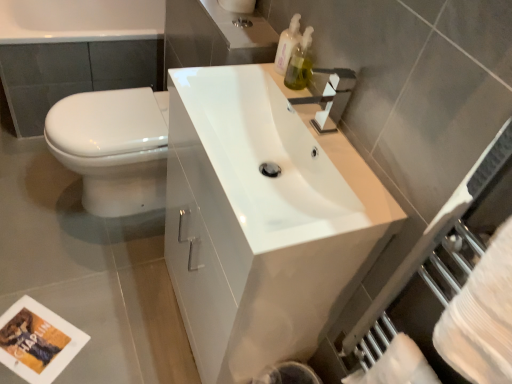
What do you see at coordinates (238, 5) in the screenshot? The image size is (512, 384). I see `white matte toilet paper at upper center, the second toilet paper positioned from the front` at bounding box center [238, 5].

How much space does white matte toilet paper at upper center, marked as the 1th toilet paper in a back-to-front arrangement, occupy horizontally?

white matte toilet paper at upper center, marked as the 1th toilet paper in a back-to-front arrangement, is 4.88 inches wide.

What do you see at coordinates (262, 220) in the screenshot? Image resolution: width=512 pixels, height=384 pixels. I see `white glossy sink at center` at bounding box center [262, 220].

Measure the distance between point (236, 20) and camera.

Point (236, 20) is 4.06 feet away from camera.

Where is `matte silver faucet at upper center`? matte silver faucet at upper center is located at coordinates (242, 22).

Describe the element at coordinates (287, 44) in the screenshot. I see `translucent plastic soap dispenser at upper right, arranged as the 1th soap dispenser when viewed from the top` at that location.

Where is `translucent plastic soap dispenser at upper right, the 2th soap dispenser from the bottom`? This screenshot has height=384, width=512. translucent plastic soap dispenser at upper right, the 2th soap dispenser from the bottom is located at coordinates (287, 44).

In the scene shown: What is the approximate width of white paper towel at lower right, the second toilet paper viewed from the left?

It is 8.14 centimeters.

You are a GUI agent. You are given a task and a screenshot of the screen. Output one action in this format:
    pyautogui.click(x=<x>, y=<y>)
    Task: Click on the white glossy bathtub at upper left
    
    Given the screenshot: What is the action you would take?
    pyautogui.click(x=76, y=52)

Find the location of `translucent plastic soap dispenser at upper right, which is the 1th soap dispenser from bottom to top`. translucent plastic soap dispenser at upper right, which is the 1th soap dispenser from bottom to top is located at coordinates (300, 63).

Image resolution: width=512 pixels, height=384 pixels. I want to click on white matte toilet paper at upper center, arranged as the second toilet paper when ordered from the bottom, so click(238, 5).

Looking at this image, is translucent plastic soap dispenser at upper right, the 2th soap dispenser from the bottom, bigger or smaller than white glossy toilet at left?

Considering their sizes, translucent plastic soap dispenser at upper right, the 2th soap dispenser from the bottom, takes up less space than white glossy toilet at left.

Is translucent plastic soap dispenser at upper right, arranged as the 1th soap dispenser when viewed from the top, at the right side of white glossy toilet at left?

Yes.

Is translucent plastic soap dispenser at upper right, arranged as the 1th soap dispenser when viewed from the top, shorter than white glossy toilet at left?

Yes, translucent plastic soap dispenser at upper right, arranged as the 1th soap dispenser when viewed from the top, is shorter than white glossy toilet at left.

From the image's perspective, is translucent plastic soap dispenser at upper right, arranged as the 1th soap dispenser when viewed from the top, below white glossy toilet at left?

Actually, translucent plastic soap dispenser at upper right, arranged as the 1th soap dispenser when viewed from the top, appears above white glossy toilet at left in the image.

Considering the sizes of objects translucent plastic soap dispenser at upper right, which is the 1th soap dispenser from bottom to top, and translucent plastic soap dispenser at upper right, arranged as the 1th soap dispenser when viewed from the top, in the image provided, who is bigger, translucent plastic soap dispenser at upper right, which is the 1th soap dispenser from bottom to top, or translucent plastic soap dispenser at upper right, arranged as the 1th soap dispenser when viewed from the top,?

Bigger between the two is translucent plastic soap dispenser at upper right, arranged as the 1th soap dispenser when viewed from the top.

How many degrees apart are the facing directions of translucent plastic soap dispenser at upper right, which appears as the 2th soap dispenser when viewed from the top, and translucent plastic soap dispenser at upper right, the 2th soap dispenser from the bottom?

The angle between the facing direction of translucent plastic soap dispenser at upper right, which appears as the 2th soap dispenser when viewed from the top, and the facing direction of translucent plastic soap dispenser at upper right, the 2th soap dispenser from the bottom, is 4.41 degrees.

Does translucent plastic soap dispenser at upper right, which is the 1th soap dispenser from bottom to top, come in front of translucent plastic soap dispenser at upper right, the 2th soap dispenser from the bottom?

Yes, translucent plastic soap dispenser at upper right, which is the 1th soap dispenser from bottom to top, is closer to the camera.

Locate an element on the screen. Image resolution: width=512 pixels, height=384 pixels. soap dispenser above the translucent plastic soap dispenser at upper right, which is the 1th soap dispenser from bottom to top (from the image's perspective) is located at coordinates (287, 44).

Which is more to the right, white matte toilet paper at upper center, arranged as the second toilet paper when ordered from the bottom, or white paper towel at lower right, marked as the first toilet paper in a front-to-back arrangement?

white paper towel at lower right, marked as the first toilet paper in a front-to-back arrangement.

Is white paper towel at lower right, arranged as the second toilet paper when viewed from the top, at the back of white matte toilet paper at upper center, marked as the 1th toilet paper in a back-to-front arrangement?

white matte toilet paper at upper center, marked as the 1th toilet paper in a back-to-front arrangement, is not turned away from white paper towel at lower right, arranged as the second toilet paper when viewed from the top.

In the image, there is a white matte toilet paper at upper center, marked as the second toilet paper in a right-to-left arrangement. Where is `toilet paper below it (from a real-world perspective)`? The height and width of the screenshot is (384, 512). toilet paper below it (from a real-world perspective) is located at coordinates (397, 366).

From the image's perspective, which is above, white matte toilet paper at upper center, the second toilet paper positioned from the front, or white paper towel at lower right, arranged as the second toilet paper when viewed from the top?

white matte toilet paper at upper center, the second toilet paper positioned from the front.

Is white glossy sink at center in contact with matte silver faucet at upper center?

No, white glossy sink at center is not in contact with matte silver faucet at upper center.

Between white glossy sink at center and matte silver faucet at upper center, which one is positioned behind?

matte silver faucet at upper center is behind.

Between white glossy sink at center and matte silver faucet at upper center, which one has less height?

With less height is matte silver faucet at upper center.

Looking at this image, who is smaller, white glossy sink at center or translucent plastic soap dispenser at upper right, the 2th soap dispenser from the bottom?

With smaller size is translucent plastic soap dispenser at upper right, the 2th soap dispenser from the bottom.

Does white glossy sink at center have a lesser height compared to translucent plastic soap dispenser at upper right, arranged as the 1th soap dispenser when viewed from the top?

No, white glossy sink at center is not shorter than translucent plastic soap dispenser at upper right, arranged as the 1th soap dispenser when viewed from the top.

Which is in front, white glossy sink at center or translucent plastic soap dispenser at upper right, the 2th soap dispenser from the bottom?

white glossy sink at center is in front.

Which is behind, point (316, 239) or point (279, 58)?

Point (279, 58)

Which of these two, translucent plastic soap dispenser at upper right, which appears as the 2th soap dispenser when viewed from the top, or white glossy toilet at left, stands taller?

Standing taller between the two is white glossy toilet at left.

Is translucent plastic soap dispenser at upper right, which appears as the 2th soap dispenser when viewed from the top, in contact with white glossy toilet at left?

No.

Is translucent plastic soap dispenser at upper right, which appears as the 2th soap dispenser when viewed from the top, surrounding white glossy toilet at left?

No, white glossy toilet at left is not inside translucent plastic soap dispenser at upper right, which appears as the 2th soap dispenser when viewed from the top.

Could you measure the distance between translucent plastic soap dispenser at upper right, which is the 1th soap dispenser from bottom to top, and white glossy toilet at left?

29.57 inches.

From a real-world perspective, is matte silver faucet at upper center beneath translucent plastic soap dispenser at upper right, which is the 1th soap dispenser from bottom to top?

Yes, from a real-world perspective, matte silver faucet at upper center is beneath translucent plastic soap dispenser at upper right, which is the 1th soap dispenser from bottom to top.

Does point (244, 20) lie in front of point (296, 88)?

No, it is not.

Is matte silver faucet at upper center positioned far away from translucent plastic soap dispenser at upper right, which appears as the 2th soap dispenser when viewed from the top?

matte silver faucet at upper center is actually quite close to translucent plastic soap dispenser at upper right, which appears as the 2th soap dispenser when viewed from the top.

Which of these two, matte silver faucet at upper center or translucent plastic soap dispenser at upper right, which appears as the 2th soap dispenser when viewed from the top, is smaller?

With smaller size is matte silver faucet at upper center.

At what (x,y) coordinates should I click in order to perform the action: click on toilet that appears behind the translucent plastic soap dispenser at upper right, the 2th soap dispenser from the bottom. Please return your answer as a coordinate pair (x, y). The height and width of the screenshot is (384, 512). Looking at the image, I should click on (113, 147).

Find the location of a particular element. soap dispenser located on the left of translucent plastic soap dispenser at upper right, which appears as the 2th soap dispenser when viewed from the top is located at coordinates [x=287, y=44].

Looking at the image, which one is located further to matte silver faucet at upper center, white glossy toilet at left or translucent plastic soap dispenser at upper right, the 2th soap dispenser from the bottom?

white glossy toilet at left lies further to matte silver faucet at upper center than the other object.

Which object lies nearer to the anchor point white glossy sink at center, matte silver faucet at upper center or white glossy toilet at left?

Among the two, white glossy toilet at left is located nearer to white glossy sink at center.

From the image, which object appears to be nearer to white glossy bathtub at upper left, translucent plastic soap dispenser at upper right, which is the 1th soap dispenser from bottom to top, or matte silver faucet at upper center?

Based on the image, matte silver faucet at upper center appears to be nearer to white glossy bathtub at upper left.

Looking at the image, which one is located closer to white paper towel at lower right, marked as the first toilet paper in a front-to-back arrangement, white matte toilet paper at upper center, which is the 1th toilet paper from left to right, or white glossy bathtub at upper left?

white matte toilet paper at upper center, which is the 1th toilet paper from left to right.

From the image, which object appears to be nearer to matte silver faucet at upper center, white glossy bathtub at upper left or white glossy toilet at left?

Among the two, white glossy toilet at left is located nearer to matte silver faucet at upper center.

Estimate the real-world distances between objects in this image. Which object is closer to translucent plastic soap dispenser at upper right, arranged as the 1th soap dispenser when viewed from the top, white matte toilet paper at upper center, marked as the 1th toilet paper in a back-to-front arrangement, or matte silver faucet at upper center?

Among the two, matte silver faucet at upper center is located nearer to translucent plastic soap dispenser at upper right, arranged as the 1th soap dispenser when viewed from the top.

Looking at the image, which one is located closer to matte silver faucet at upper center, translucent plastic soap dispenser at upper right, which is the 1th soap dispenser from bottom to top, or white glossy toilet at left?

translucent plastic soap dispenser at upper right, which is the 1th soap dispenser from bottom to top.

Estimate the real-world distances between objects in this image. Which object is further from white glossy sink at center, translucent plastic soap dispenser at upper right, which is the 1th soap dispenser from bottom to top, or matte silver faucet at upper center?

The object further to white glossy sink at center is matte silver faucet at upper center.

Where is `soap dispenser between white glossy bathtub at upper left and translucent plastic soap dispenser at upper right, which appears as the 2th soap dispenser when viewed from the top, in the horizontal direction`? The width and height of the screenshot is (512, 384). soap dispenser between white glossy bathtub at upper left and translucent plastic soap dispenser at upper right, which appears as the 2th soap dispenser when viewed from the top, in the horizontal direction is located at coordinates (287, 44).

You are a GUI agent. You are given a task and a screenshot of the screen. Output one action in this format:
    pyautogui.click(x=<x>, y=<y>)
    Task: Click on the toilet between matte silver faucet at upper center and white glossy sink at center in the up-down direction
    
    Given the screenshot: What is the action you would take?
    pyautogui.click(x=113, y=147)

Identify the location of plumbing fixture between white glossy bathtub at upper left and white paper towel at lower right, which is the first toilet paper in right-to-left order, in the vertical direction. (242, 22).

Where is `toilet paper between white glossy bathtub at upper left and white glossy sink at center in the vertical direction`? The image size is (512, 384). toilet paper between white glossy bathtub at upper left and white glossy sink at center in the vertical direction is located at coordinates (238, 5).